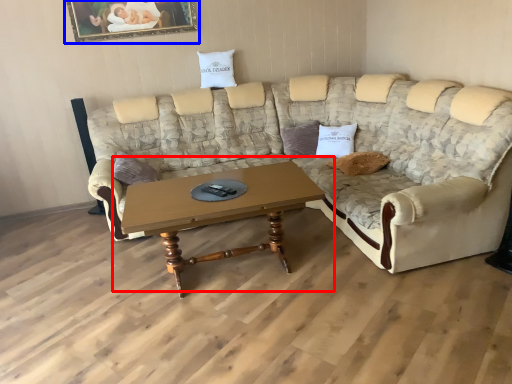
Question: Which point is further to the camera, coffee table (highlighted by a red box) or picture frame (highlighted by a blue box)?

Choices:
 (A) coffee table
 (B) picture frame

Answer: (B)